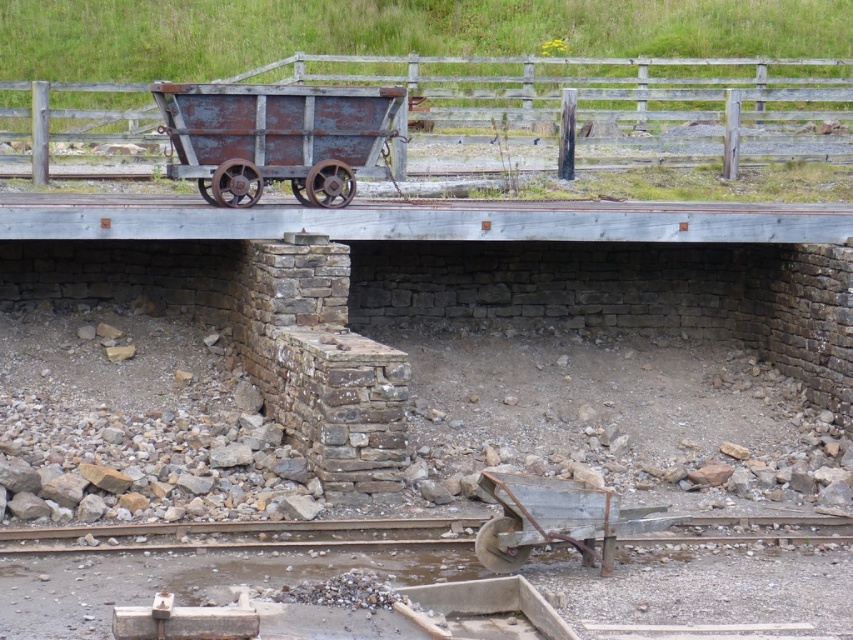
Question: Among these points, which one is nearest to the camera?

Choices:
 (A) (335, 116)
 (B) (508, 483)

Answer: (B)

Question: Is rusty metal cart at center smaller than rusty metal wagon at lower center?

Choices:
 (A) yes
 (B) no

Answer: (B)

Question: Which object is farther from the camera taking this photo?

Choices:
 (A) rusty metal wagon at lower center
 (B) rusty metal cart at center

Answer: (B)

Question: Is rusty metal cart at center positioned before rusty metal wagon at lower center?

Choices:
 (A) yes
 (B) no

Answer: (B)

Question: Which of the following is the farthest from the observer?

Choices:
 (A) (235, 205)
 (B) (521, 502)

Answer: (A)

Question: Does rusty metal cart at center have a greater width compared to rusty metal wagon at lower center?

Choices:
 (A) no
 (B) yes

Answer: (B)